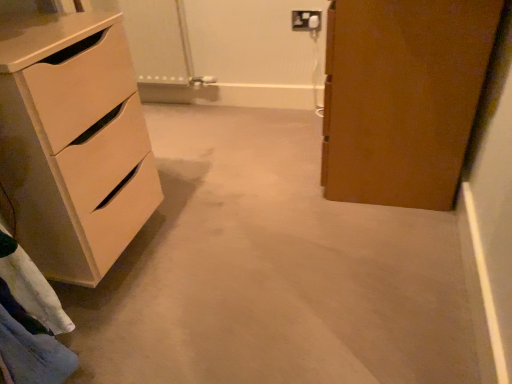
Question: From the image's perspective, is matte white chest of drawers at left located beneath beige carpet at center?

Choices:
 (A) no
 (B) yes

Answer: (A)

Question: Considering the relative sizes of matte white chest of drawers at left and beige carpet at center in the image provided, is matte white chest of drawers at left thinner than beige carpet at center?

Choices:
 (A) yes
 (B) no

Answer: (A)

Question: Is matte white chest of drawers at left with beige carpet at center?

Choices:
 (A) no
 (B) yes

Answer: (A)

Question: Is matte white chest of drawers at left bigger than beige carpet at center?

Choices:
 (A) no
 (B) yes

Answer: (A)

Question: Does matte white chest of drawers at left turn towards beige carpet at center?

Choices:
 (A) yes
 (B) no

Answer: (B)

Question: Relative to matte white chest of drawers at left, is beige carpet at center in front or behind?

Choices:
 (A) behind
 (B) front

Answer: (B)

Question: Looking at their shapes, would you say beige carpet at center is wider or thinner than matte white chest of drawers at left?

Choices:
 (A) wide
 (B) thin

Answer: (A)

Question: From the image's perspective, relative to matte white chest of drawers at left, is beige carpet at center above or below?

Choices:
 (A) above
 (B) below

Answer: (B)

Question: In the image, is beige carpet at center on the left side or the right side of matte white chest of drawers at left?

Choices:
 (A) left
 (B) right

Answer: (B)

Question: From the image's perspective, is white plastic electric outlet at upper center positioned above or below matte white chest of drawers at left?

Choices:
 (A) above
 (B) below

Answer: (A)

Question: Is white plastic electric outlet at upper center inside the boundaries of matte white chest of drawers at left, or outside?

Choices:
 (A) outside
 (B) inside

Answer: (A)

Question: Is point (296, 26) closer or farther from the camera than point (81, 208)?

Choices:
 (A) farther
 (B) closer

Answer: (A)

Question: Is white plastic electric outlet at upper center in front of or behind matte white chest of drawers at left in the image?

Choices:
 (A) behind
 (B) front

Answer: (A)

Question: Is beige carpet at center inside or outside of white plastic electric outlet at upper center?

Choices:
 (A) outside
 (B) inside

Answer: (A)

Question: Looking at their shapes, would you say beige carpet at center is wider or thinner than white plastic electric outlet at upper center?

Choices:
 (A) thin
 (B) wide

Answer: (B)